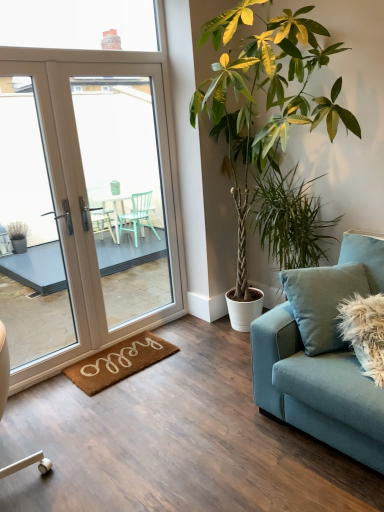
You are a GUI agent. You are given a task and a screenshot of the screen. Output one action in this format:
    pyautogui.click(x=<x>, y=<y>)
    Task: Click on the free point above brown coir mat at lower left (from a real-world perspective)
    This screenshot has width=384, height=512.
    Given the screenshot: What is the action you would take?
    pyautogui.click(x=132, y=351)